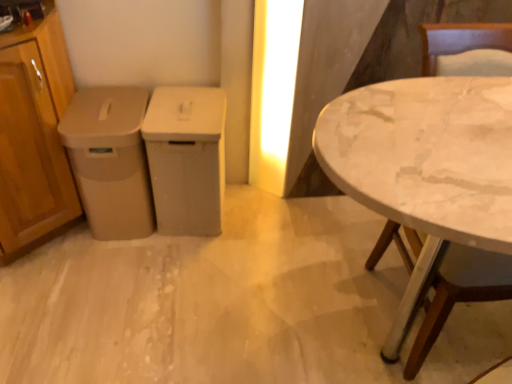
Measure the distance between point (149, 225) and camera.

Point (149, 225) is 1.84 meters away from camera.

Find the location of a particular element. matte plastic trash can at center, the 3th cabinetry in the left-to-right sequence is located at coordinates tap(186, 158).

Describe the element at coordinates (186, 158) in the screenshot. The image size is (512, 384). I see `matte plastic trash can at center, which is counted as the 1th cabinetry, starting from the right` at that location.

The height and width of the screenshot is (384, 512). What are the coordinates of `white marble table at right` in the screenshot? It's located at (424, 169).

Considering the positions of point (28, 89) and point (202, 151), is point (28, 89) closer or farther from the camera than point (202, 151)?

Point (28, 89) is positioned closer to the camera compared to point (202, 151).

Does wooden cabinet at left, the 3th cabinetry viewed from the right, lie in front of matte plastic trash can at center, the 3th cabinetry in the left-to-right sequence?

Yes, wooden cabinet at left, the 3th cabinetry viewed from the right, is closer to the viewer.

From the image's perspective, is wooden cabinet at left, the 3th cabinetry viewed from the right, beneath matte plastic trash can at center, which is counted as the 1th cabinetry, starting from the right?

No, from the image's perspective, wooden cabinet at left, the 3th cabinetry viewed from the right, is not below matte plastic trash can at center, which is counted as the 1th cabinetry, starting from the right.

Considering the relative sizes of wooden cabinet at left, the 3th cabinetry viewed from the right, and matte plastic trash can at center, the 3th cabinetry in the left-to-right sequence, in the image provided, is wooden cabinet at left, the 3th cabinetry viewed from the right, bigger than matte plastic trash can at center, the 3th cabinetry in the left-to-right sequence,?

Indeed, wooden cabinet at left, the 3th cabinetry viewed from the right, has a larger size compared to matte plastic trash can at center, the 3th cabinetry in the left-to-right sequence.

Considering the relative positions of matte plastic trash can at center, the 3th cabinetry in the left-to-right sequence, and wooden cabinet at left, the 3th cabinetry viewed from the right, in the image provided, is matte plastic trash can at center, the 3th cabinetry in the left-to-right sequence, to the right of wooden cabinet at left, the 3th cabinetry viewed from the right, from the viewer's perspective?

Yes, matte plastic trash can at center, the 3th cabinetry in the left-to-right sequence, is to the right of wooden cabinet at left, the 3th cabinetry viewed from the right.

Could you measure the distance between matte plastic trash can at center, the 3th cabinetry in the left-to-right sequence, and wooden cabinet at left, the 3th cabinetry viewed from the right?

They are 17.70 inches apart.

Is matte plastic trash can at center, the 3th cabinetry in the left-to-right sequence, next to wooden cabinet at left, which ranks as the first cabinetry in left-to-right order?

No, matte plastic trash can at center, the 3th cabinetry in the left-to-right sequence, is not with wooden cabinet at left, which ranks as the first cabinetry in left-to-right order.

Where is `the 2nd cabinetry above the matte plastic trash can at center, which is counted as the 1th cabinetry, starting from the right (from a real-world perspective)`? the 2nd cabinetry above the matte plastic trash can at center, which is counted as the 1th cabinetry, starting from the right (from a real-world perspective) is located at coordinates (34, 137).

From a real-world perspective, which cabinetry is the 1st one above the matte plastic trash can at center, which is counted as the 1th cabinetry, starting from the right? Please provide its 2D coordinates.

[(110, 160)]

Considering the positions of objects matte plastic trash can at center, the 3th cabinetry in the left-to-right sequence, and beige plastic trash can at left, the 2th cabinetry when ordered from left to right, in the image provided, who is more to the left, matte plastic trash can at center, the 3th cabinetry in the left-to-right sequence, or beige plastic trash can at left, the 2th cabinetry when ordered from left to right,?

Positioned to the left is beige plastic trash can at left, the 2th cabinetry when ordered from left to right.

Which is in front, matte plastic trash can at center, the 3th cabinetry in the left-to-right sequence, or beige plastic trash can at left, the 2th cabinetry when ordered from left to right?

Positioned in front is beige plastic trash can at left, the 2th cabinetry when ordered from left to right.

Considering the sizes of objects matte plastic trash can at center, the 3th cabinetry in the left-to-right sequence, and beige plastic trash can at left, which is counted as the 2th cabinetry, starting from the right, in the image provided, who is bigger, matte plastic trash can at center, the 3th cabinetry in the left-to-right sequence, or beige plastic trash can at left, which is counted as the 2th cabinetry, starting from the right,?

beige plastic trash can at left, which is counted as the 2th cabinetry, starting from the right.

In terms of height, does beige plastic trash can at left, which is counted as the 2th cabinetry, starting from the right, look taller or shorter compared to wooden cabinet at left, the 3th cabinetry viewed from the right?

Considering their sizes, beige plastic trash can at left, which is counted as the 2th cabinetry, starting from the right, has less height than wooden cabinet at left, the 3th cabinetry viewed from the right.

How different are the orientations of beige plastic trash can at left, the 2th cabinetry when ordered from left to right, and wooden cabinet at left, the 3th cabinetry viewed from the right, in degrees?

The angular difference between beige plastic trash can at left, the 2th cabinetry when ordered from left to right, and wooden cabinet at left, the 3th cabinetry viewed from the right, is 89.6 degrees.

Who is more distant, beige plastic trash can at left, the 2th cabinetry when ordered from left to right, or wooden cabinet at left, which ranks as the first cabinetry in left-to-right order?

beige plastic trash can at left, the 2th cabinetry when ordered from left to right.

Which of these two, white marble table at right or beige plastic trash can at left, which is counted as the 2th cabinetry, starting from the right, is wider?

white marble table at right.

Is white marble table at right to the left of beige plastic trash can at left, which is counted as the 2th cabinetry, starting from the right, from the viewer's perspective?

No, white marble table at right is not to the left of beige plastic trash can at left, which is counted as the 2th cabinetry, starting from the right.

Based on the photo, would you say white marble table at right contains beige plastic trash can at left, the 2th cabinetry when ordered from left to right?

No.

Could you measure the distance between matte plastic trash can at center, the 3th cabinetry in the left-to-right sequence, and white marble table at right?

matte plastic trash can at center, the 3th cabinetry in the left-to-right sequence, is 32.37 inches from white marble table at right.

Is matte plastic trash can at center, which is counted as the 1th cabinetry, starting from the right, far from white marble table at right?

No.

Would you say matte plastic trash can at center, which is counted as the 1th cabinetry, starting from the right, is inside or outside white marble table at right?

matte plastic trash can at center, which is counted as the 1th cabinetry, starting from the right, is located beyond the bounds of white marble table at right.

Is matte plastic trash can at center, which is counted as the 1th cabinetry, starting from the right, taller than white marble table at right?

Incorrect, the height of matte plastic trash can at center, which is counted as the 1th cabinetry, starting from the right, is not larger of that of white marble table at right.

From the image's perspective, is wooden cabinet at left, the 3th cabinetry viewed from the right, above or below white marble table at right?

Based on their image positions, wooden cabinet at left, the 3th cabinetry viewed from the right, is located above white marble table at right.

Is wooden cabinet at left, which ranks as the first cabinetry in left-to-right order, spatially inside white marble table at right, or outside of it?

The correct answer is: outside.

Is wooden cabinet at left, the 3th cabinetry viewed from the right, positioned far away from white marble table at right?

wooden cabinet at left, the 3th cabinetry viewed from the right, is positioned a significant distance from white marble table at right.

Does wooden cabinet at left, the 3th cabinetry viewed from the right, appear on the right side of white marble table at right?

No.

Locate an element on the screen. The height and width of the screenshot is (384, 512). the 2nd cabinetry in front when counting from the matte plastic trash can at center, which is counted as the 1th cabinetry, starting from the right is located at coordinates [x=34, y=137].

At what (x,y) coordinates should I click in order to perform the action: click on the 2nd cabinetry counting from the right of the wooden cabinet at left, which ranks as the first cabinetry in left-to-right order. Please return your answer as a coordinate pair (x, y). The width and height of the screenshot is (512, 384). Looking at the image, I should click on (186, 158).

Which object lies nearer to the anchor point white marble table at right, matte plastic trash can at center, which is counted as the 1th cabinetry, starting from the right, or beige plastic trash can at left, which is counted as the 2th cabinetry, starting from the right?

matte plastic trash can at center, which is counted as the 1th cabinetry, starting from the right, is closer to white marble table at right.

Consider the image. When comparing their distances from beige plastic trash can at left, which is counted as the 2th cabinetry, starting from the right, does matte plastic trash can at center, the 3th cabinetry in the left-to-right sequence, or wooden cabinet at left, which ranks as the first cabinetry in left-to-right order, seem closer?

Among the two, matte plastic trash can at center, the 3th cabinetry in the left-to-right sequence, is located nearer to beige plastic trash can at left, which is counted as the 2th cabinetry, starting from the right.

Looking at the image, which one is located closer to white marble table at right, beige plastic trash can at left, the 2th cabinetry when ordered from left to right, or matte plastic trash can at center, the 3th cabinetry in the left-to-right sequence?

matte plastic trash can at center, the 3th cabinetry in the left-to-right sequence, is closer to white marble table at right.

Based on their spatial positions, is beige plastic trash can at left, which is counted as the 2th cabinetry, starting from the right, or white marble table at right closer to wooden cabinet at left, the 3th cabinetry viewed from the right?

Among the two, beige plastic trash can at left, which is counted as the 2th cabinetry, starting from the right, is located nearer to wooden cabinet at left, the 3th cabinetry viewed from the right.

Based on the photo, estimate the real-world distances between objects in this image. Which object is further from wooden cabinet at left, which ranks as the first cabinetry in left-to-right order, white marble table at right or matte plastic trash can at center, which is counted as the 1th cabinetry, starting from the right?

The object further to wooden cabinet at left, which ranks as the first cabinetry in left-to-right order, is white marble table at right.

Which object lies nearer to the anchor point wooden cabinet at left, which ranks as the first cabinetry in left-to-right order, white marble table at right or beige plastic trash can at left, the 2th cabinetry when ordered from left to right?

Based on the image, beige plastic trash can at left, the 2th cabinetry when ordered from left to right, appears to be nearer to wooden cabinet at left, which ranks as the first cabinetry in left-to-right order.

Which object lies nearer to the anchor point beige plastic trash can at left, which is counted as the 2th cabinetry, starting from the right, wooden cabinet at left, which ranks as the first cabinetry in left-to-right order, or white marble table at right?

Among the two, wooden cabinet at left, which ranks as the first cabinetry in left-to-right order, is located nearer to beige plastic trash can at left, which is counted as the 2th cabinetry, starting from the right.

From the image, which object appears to be farther from matte plastic trash can at center, which is counted as the 1th cabinetry, starting from the right, wooden cabinet at left, the 3th cabinetry viewed from the right, or white marble table at right?

white marble table at right is positioned further to the anchor matte plastic trash can at center, which is counted as the 1th cabinetry, starting from the right.

At what (x,y) coordinates should I click in order to perform the action: click on cabinetry between beige plastic trash can at left, the 2th cabinetry when ordered from left to right, and white marble table at right, in the horizontal direction. Please return your answer as a coordinate pair (x, y). The image size is (512, 384). Looking at the image, I should click on (186, 158).

Locate an element on the screen. The image size is (512, 384). cabinetry between wooden cabinet at left, which ranks as the first cabinetry in left-to-right order, and matte plastic trash can at center, the 3th cabinetry in the left-to-right sequence, from left to right is located at coordinates (110, 160).